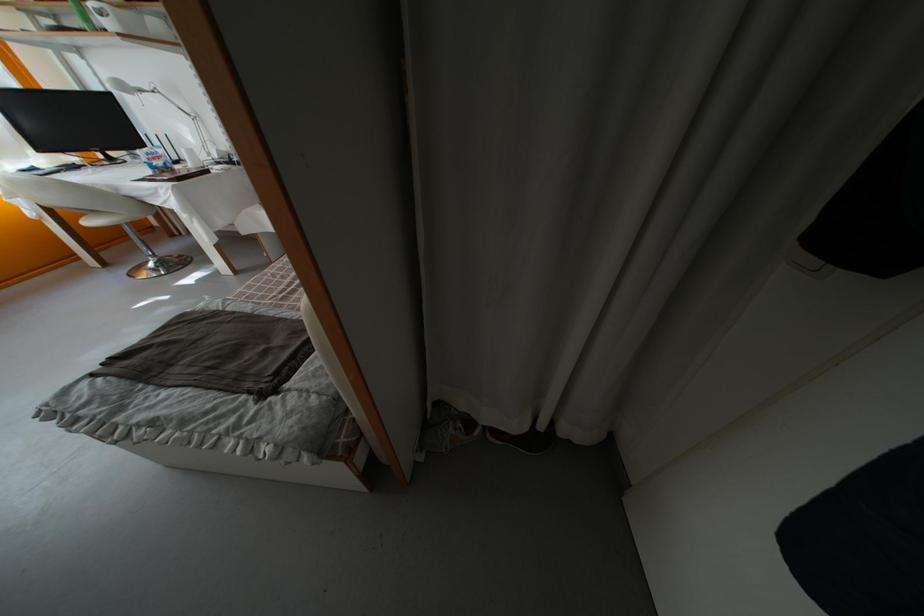
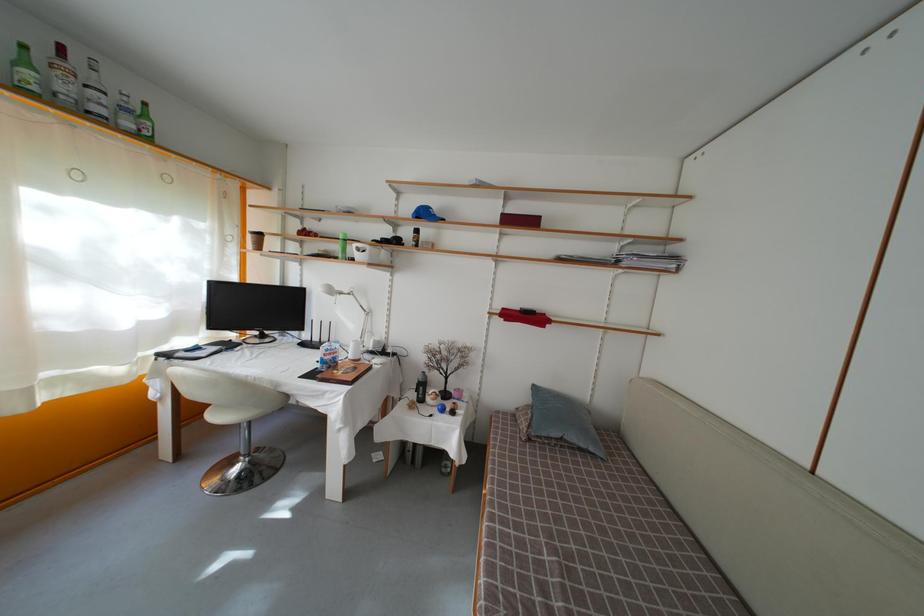
Where in the second image is the point corresponding to (115,31) from the first image?

(363, 262)